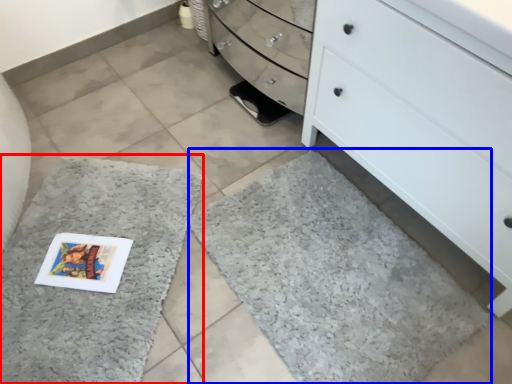
Question: Which object appears farthest to the camera in this image, bath mat (highlighted by a red box) or bath mat (highlighted by a blue box)?

Choices:
 (A) bath mat
 (B) bath mat

Answer: (A)